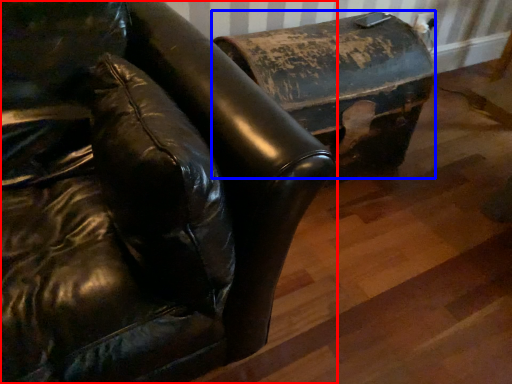
Question: Which object is further to the camera taking this photo, furniture (highlighted by a red box) or furniture (highlighted by a blue box)?

Choices:
 (A) furniture
 (B) furniture

Answer: (B)